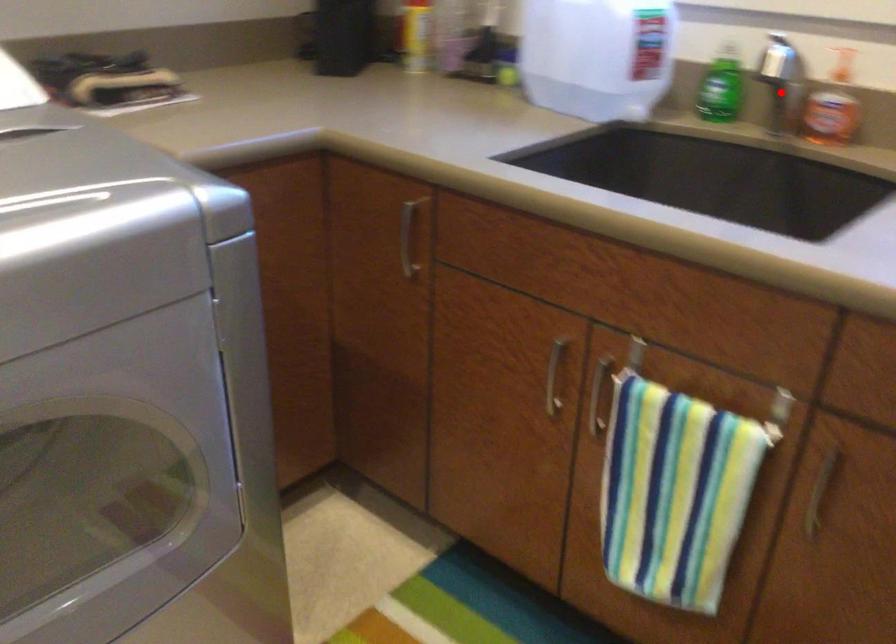
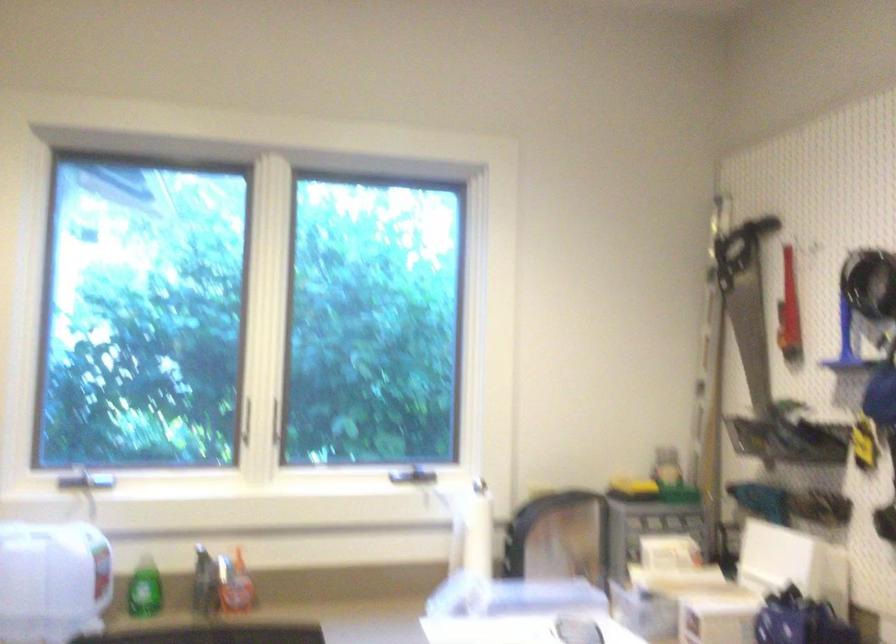
Question: I am providing you with two images of the same scene from different viewpoints. A red point is shown in image1. For the corresponding object point in image2, is it positioned nearer or farther from the camera?

Choices:
 (A) Nearer
 (B) Farther

Answer: (B)